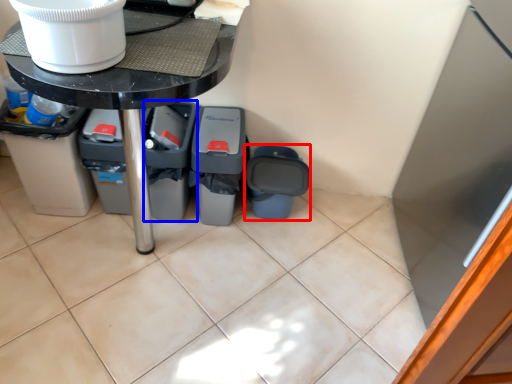
Question: Among these objects, which one is farthest to the camera, recycling bin (highlighted by a red box) or recycling bin (highlighted by a blue box)?

Choices:
 (A) recycling bin
 (B) recycling bin

Answer: (A)